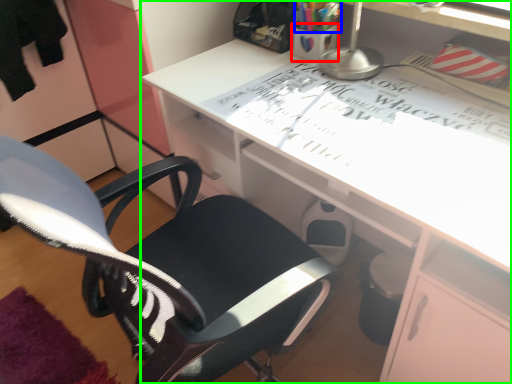
Question: Considering the real-world distances, which object is closest to stationery (highlighted by a red box)? stationery (highlighted by a blue box) or desk (highlighted by a green box).

Choices:
 (A) stationery
 (B) desk

Answer: (A)